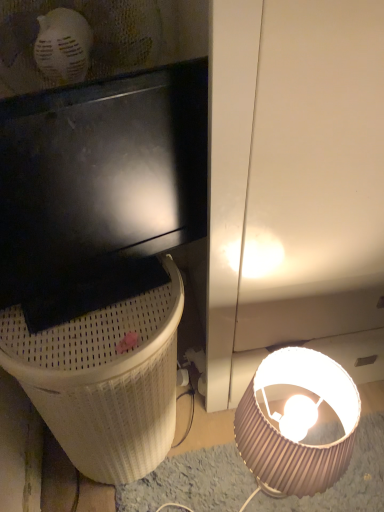
Question: Looking at their shapes, would you say white textured trash bin/can at lower left is wider or thinner than pink pleated lampshade at lower right?

Choices:
 (A) wide
 (B) thin

Answer: (A)

Question: From a real-world perspective, is white textured trash bin/can at lower left physically located above or below pink pleated lampshade at lower right?

Choices:
 (A) below
 (B) above

Answer: (B)

Question: Does point (6, 362) appear closer or farther from the camera than point (332, 463)?

Choices:
 (A) farther
 (B) closer

Answer: (B)

Question: From the image's perspective, relative to white textured trash bin/can at lower left, is pink pleated lampshade at lower right above or below?

Choices:
 (A) above
 (B) below

Answer: (B)

Question: Is pink pleated lampshade at lower right in front of or behind white textured trash bin/can at lower left in the image?

Choices:
 (A) front
 (B) behind

Answer: (B)

Question: From a real-world perspective, is pink pleated lampshade at lower right above or below white textured trash bin/can at lower left?

Choices:
 (A) below
 (B) above

Answer: (A)

Question: Which is correct: pink pleated lampshade at lower right is inside white textured trash bin/can at lower left, or outside of it?

Choices:
 (A) inside
 (B) outside

Answer: (B)